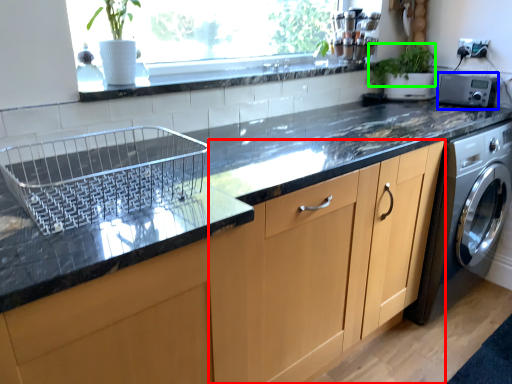
Question: Considering the real-world distances, which object is closest to cabinetry (highlighted by a red box)? appliance (highlighted by a blue box) or plant (highlighted by a green box).

Choices:
 (A) appliance
 (B) plant

Answer: (A)